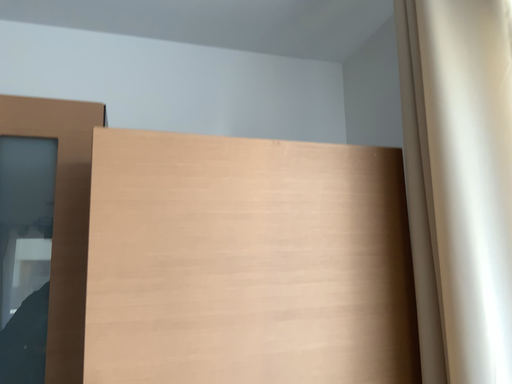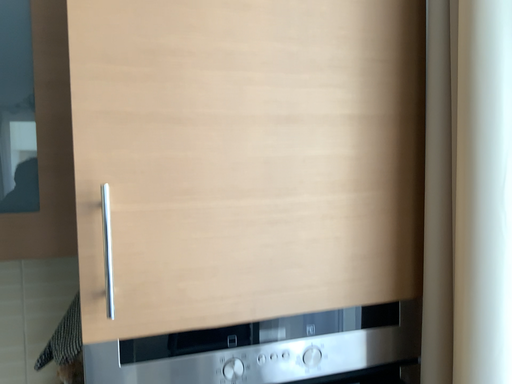
Question: How did the camera likely rotate when shooting the video?

Choices:
 (A) rotated downward
 (B) rotated upward

Answer: (A)